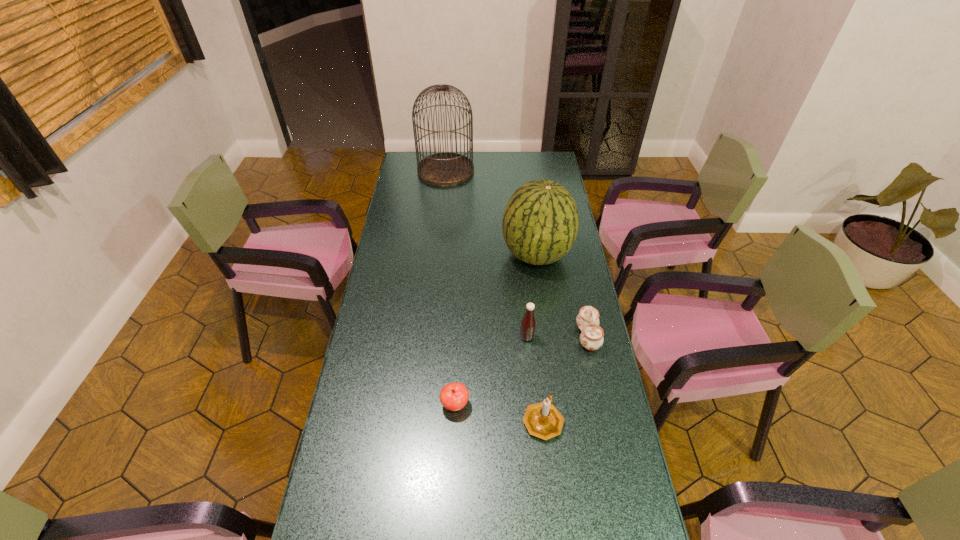
Where is `object that is at the far left corner`? The height and width of the screenshot is (540, 960). object that is at the far left corner is located at coordinates (442, 169).

This screenshot has width=960, height=540. I want to click on free spot at the left edge of the desktop, so click(x=410, y=205).

Image resolution: width=960 pixels, height=540 pixels. What are the coordinates of `free space at the right edge` in the screenshot? It's located at (574, 464).

Locate an element on the screen. vacant area between the second shortest object and the candle holder is located at coordinates (565, 379).

I want to click on unoccupied position between the Tabasco sauce and the apple, so click(491, 371).

The width and height of the screenshot is (960, 540). In order to click on vacant area that lies between the third shortest object and the second shortest object in this screenshot , I will do `click(565, 379)`.

Find the location of a particular element. empty space between the apple and the Tabasco sauce is located at coordinates (491, 371).

Locate an element on the screen. The width and height of the screenshot is (960, 540). free space between the Tabasco sauce and the candle holder is located at coordinates (535, 379).

Where is `vacant space that's between the fifth nearest object and the Tabasco sauce`? Image resolution: width=960 pixels, height=540 pixels. vacant space that's between the fifth nearest object and the Tabasco sauce is located at coordinates (532, 296).

The width and height of the screenshot is (960, 540). Identify the location of empty space that is in between the apple and the Tabasco sauce. (491, 371).